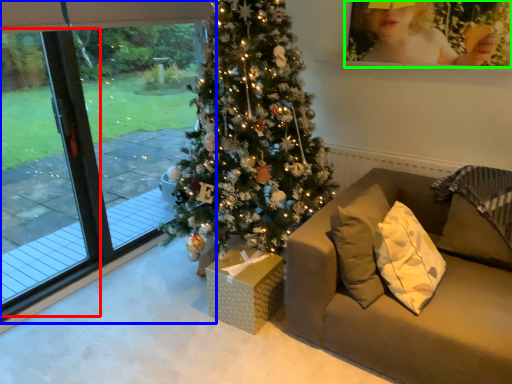
Question: Considering the real-world distances, which object is closest to screen door (highlighted by a red box)? window (highlighted by a blue box) or picture frame (highlighted by a green box).

Choices:
 (A) window
 (B) picture frame

Answer: (A)